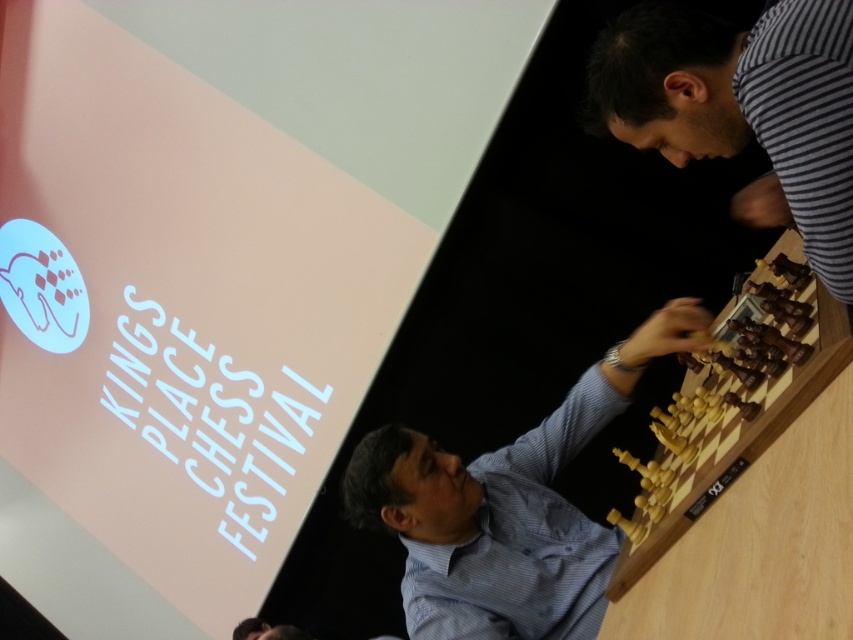
Question: Observing the image, what is the correct spatial positioning of striped fabric at upper right in reference to light wood chess set at right?

Choices:
 (A) left
 (B) right

Answer: (A)

Question: In this image, where is striped cotton shirt at upper right located relative to light wood chess set at right?

Choices:
 (A) left
 (B) right

Answer: (A)

Question: Which is nearer to the light wood chess set at right?

Choices:
 (A) striped cotton shirt at upper right
 (B) light brown wood chess set at center
 (C) striped fabric at upper right

Answer: (B)

Question: Which object appears farthest from the camera in this image?

Choices:
 (A) light brown wood chess set at center
 (B) striped fabric at upper right

Answer: (A)

Question: Which object appears farthest from the camera in this image?

Choices:
 (A) striped cotton shirt at upper right
 (B) light brown wood chess set at center
 (C) light wood chess set at right
 (D) striped fabric at upper right

Answer: (B)

Question: In this image, where is light brown wood chess set at center located relative to striped cotton shirt at upper right?

Choices:
 (A) left
 (B) right

Answer: (A)